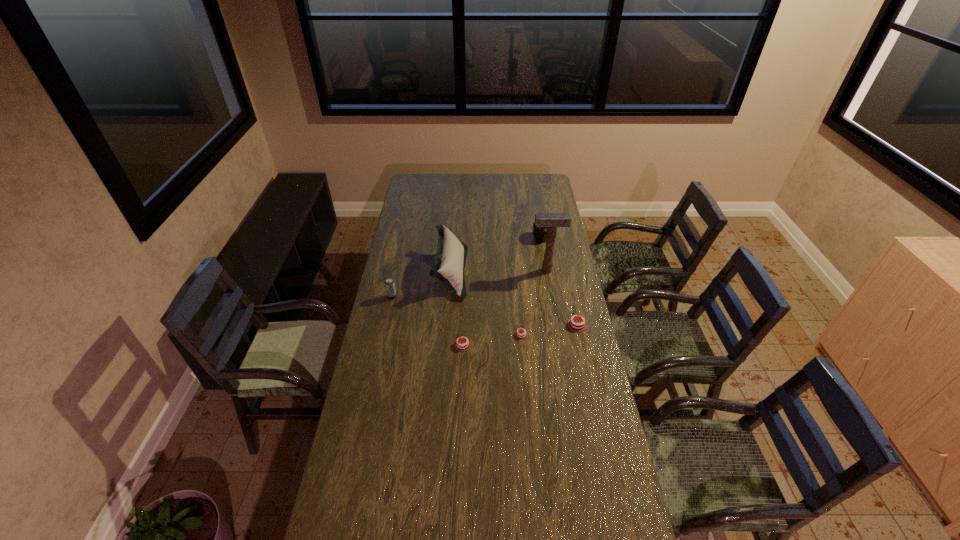
Find the location of a particular element. chocolate cake that is at the right edge is located at coordinates (574, 325).

Identify the location of telephoto lens that is at the right edge. (540, 233).

At what (x,y) coordinates should I click in order to perform the action: click on mallet located in the right edge section of the desktop. Please return your answer as a coordinate pair (x, y). This screenshot has width=960, height=540. Looking at the image, I should click on (551, 220).

Where is `free location at the far edge`? The image size is (960, 540). free location at the far edge is located at coordinates (489, 174).

Where is `free region at the left edge of the desktop`? Image resolution: width=960 pixels, height=540 pixels. free region at the left edge of the desktop is located at coordinates (402, 316).

I want to click on free region at the right edge of the desktop, so click(548, 210).

Locate an element on the screen. The height and width of the screenshot is (540, 960). free point between the telephoto lens and the cushion is located at coordinates (496, 254).

This screenshot has height=540, width=960. Identify the location of free space that is in between the beer can and the telephoto lens. (467, 267).

Where is `vacant area that lies between the cushion and the beer can`? This screenshot has width=960, height=540. vacant area that lies between the cushion and the beer can is located at coordinates (421, 285).

The width and height of the screenshot is (960, 540). What are the coordinates of `vacant area that lies between the third shortest object and the beer can` in the screenshot? It's located at (485, 311).